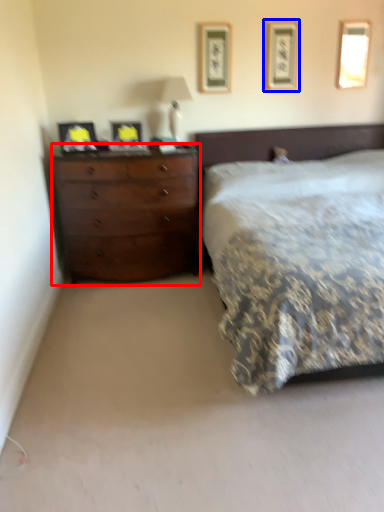
Question: Which of the following is the closest to the observer, chest of drawers (highlighted by a red box) or picture frame (highlighted by a blue box)?

Choices:
 (A) chest of drawers
 (B) picture frame

Answer: (A)